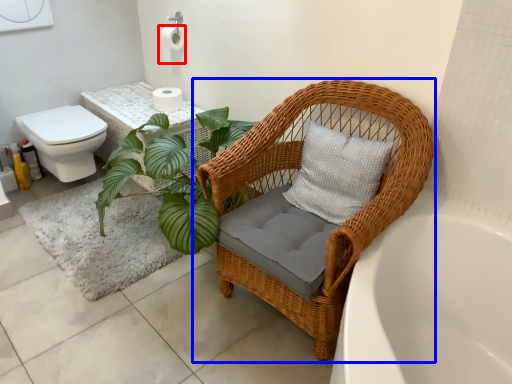
Question: Which object is further to the camera taking this photo, toilet paper (highlighted by a red box) or chair (highlighted by a blue box)?

Choices:
 (A) toilet paper
 (B) chair

Answer: (A)